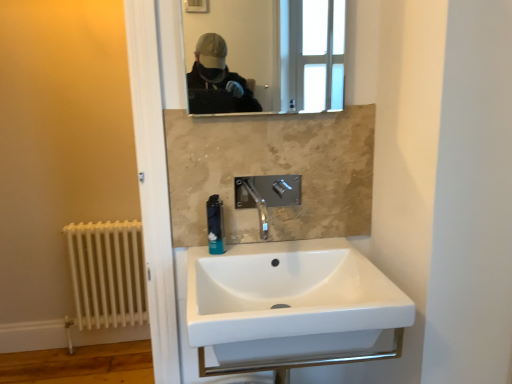
Locate an element on the screen. free spot below polished chrome faucet at center (from a real-world perspective) is located at coordinates (274, 252).